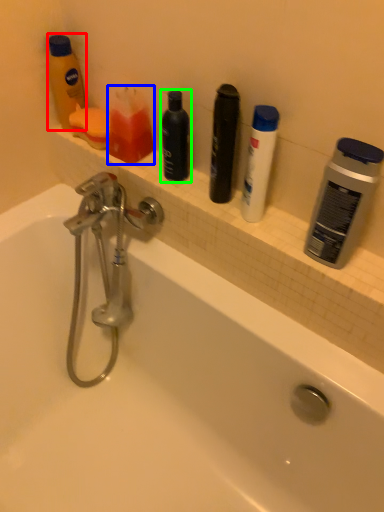
Question: Considering the real-world distances, which object is closest to toiletry (highlighted by a red box)? toiletry (highlighted by a blue box) or personal care (highlighted by a green box).

Choices:
 (A) toiletry
 (B) personal care

Answer: (A)